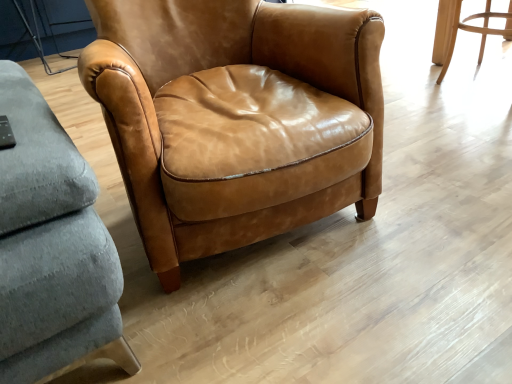
Question: Considering their positions, is matte brown leather chair at center, the 2th chair from the left, located in front of or behind matte leather chair at center, arranged as the first chair when viewed from the front?

Choices:
 (A) behind
 (B) front

Answer: (A)

Question: From the image's perspective, relative to matte leather chair at center, which appears as the 2th chair when viewed from the back, is matte brown leather chair at center, marked as the second chair in a front-to-back arrangement, above or below?

Choices:
 (A) above
 (B) below

Answer: (A)

Question: From a real-world perspective, is matte brown leather chair at center, the 2th chair from the left, physically located above or below matte leather chair at center, the second chair in the right-to-left sequence?

Choices:
 (A) below
 (B) above

Answer: (A)

Question: In terms of width, does matte leather chair at center, which appears as the 2th chair when viewed from the back, look wider or thinner when compared to matte brown leather chair at center, acting as the 1th chair starting from the back?

Choices:
 (A) thin
 (B) wide

Answer: (B)

Question: In terms of size, does matte leather chair at center, arranged as the first chair when viewed from the front, appear bigger or smaller than matte brown leather chair at center, acting as the 1th chair starting from the right?

Choices:
 (A) big
 (B) small

Answer: (A)

Question: In terms of height, does matte leather chair at center, placed as the 1th chair when sorted from left to right, look taller or shorter compared to matte brown leather chair at center, the 2th chair from the left?

Choices:
 (A) short
 (B) tall

Answer: (B)

Question: From the image's perspective, is matte leather chair at center, arranged as the first chair when viewed from the front, located above or below matte brown leather chair at center, acting as the 1th chair starting from the right?

Choices:
 (A) below
 (B) above

Answer: (A)